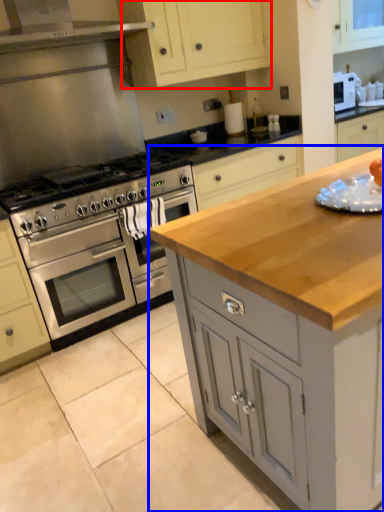
Question: Which of the following is the farthest to the observer, cabinetry (highlighted by a red box) or cabinetry (highlighted by a blue box)?

Choices:
 (A) cabinetry
 (B) cabinetry

Answer: (A)